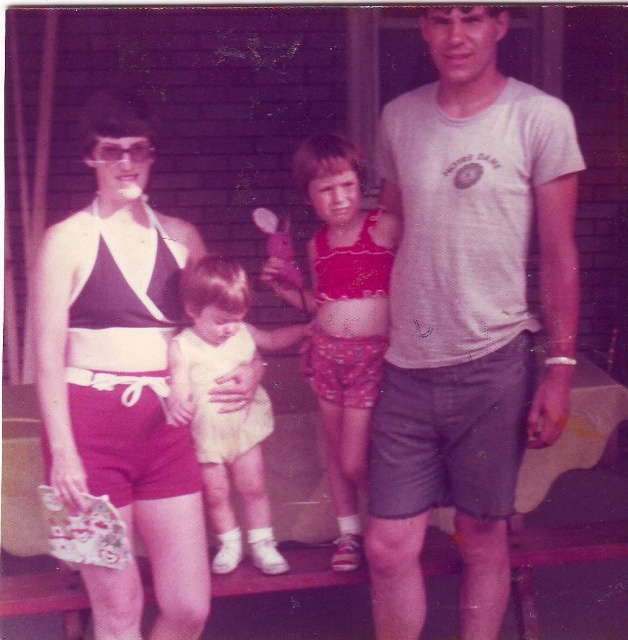
Question: Which is farther from the white cotton dress at center?

Choices:
 (A) matte black swimsuit at left
 (B) white cotton t-shirt at center

Answer: (B)

Question: Which of the following is the closest to the observer?

Choices:
 (A) (176, 358)
 (B) (458, 148)
 (C) (327, 268)
 (D) (45, 419)

Answer: (D)

Question: Is white cotton t-shirt at center bigger than white cotton dress at center?

Choices:
 (A) yes
 (B) no

Answer: (A)

Question: Among these objects, which one is farthest from the camera?

Choices:
 (A) matte black swimsuit at left
 (B) white cotton dress at center
 (C) red cotton swimsuit at center
 (D) white cotton t-shirt at center

Answer: (C)

Question: Does white cotton t-shirt at center have a greater width compared to matte black swimsuit at left?

Choices:
 (A) yes
 (B) no

Answer: (A)

Question: Considering the relative positions of white cotton t-shirt at center and white cotton dress at center in the image provided, where is white cotton t-shirt at center located with respect to white cotton dress at center?

Choices:
 (A) right
 (B) left

Answer: (A)